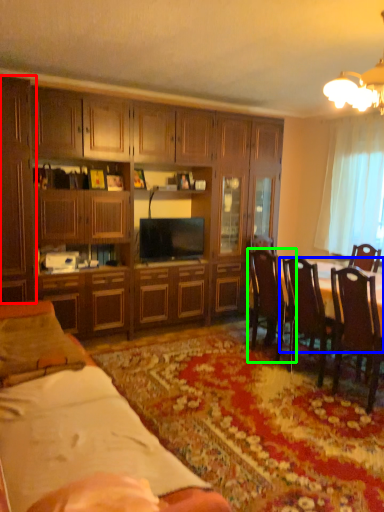
Question: Estimate the real-world distances between objects in this image. Which object is closer to cabinetry (highlighted by a red box), round table (highlighted by a blue box) or chair (highlighted by a green box)?

Choices:
 (A) round table
 (B) chair

Answer: (B)